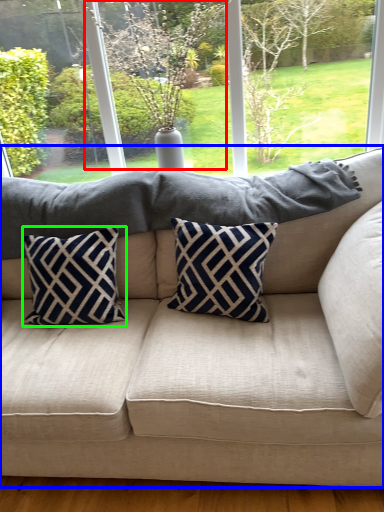
Question: Which is farther away from tree (highlighted by a red box)? studio couch (highlighted by a blue box) or pillow (highlighted by a green box)?

Choices:
 (A) studio couch
 (B) pillow

Answer: (A)